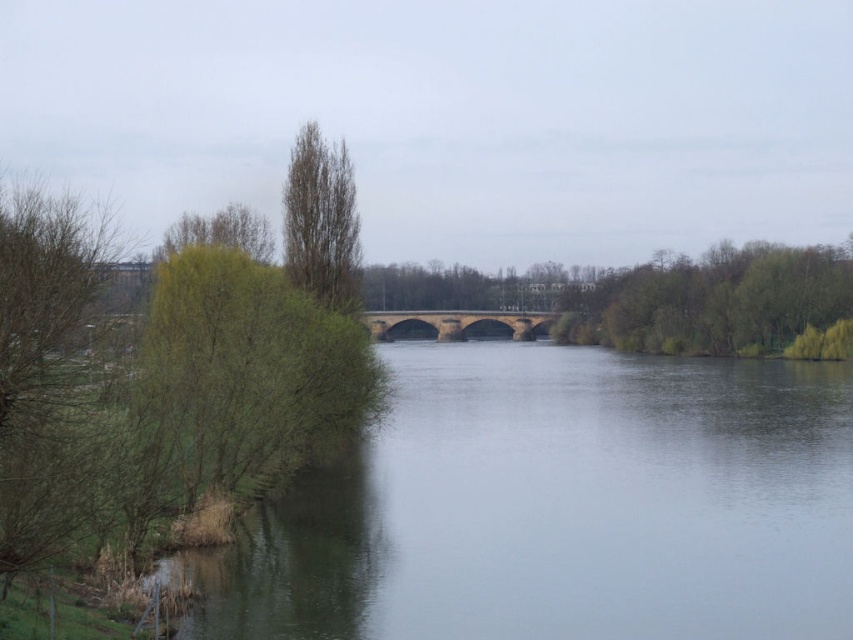
Who is positioned more to the left, clear water at center or green leafy tree at upper right?

clear water at center

Which is behind, point (490, 387) or point (682, 317)?

The point (682, 317) is more distant.

You are a GUI agent. You are given a task and a screenshot of the screen. Output one action in this format:
    pyautogui.click(x=<x>, y=<y>)
    Task: Click on the clear water at center
    The image size is (853, 640).
    Given the screenshot: What is the action you would take?
    [560, 508]

Does clear water at center appear over brown textured tree at upper center?

No, clear water at center is not above brown textured tree at upper center.

Is clear water at center smaller than brown textured tree at upper center?

No.

You are a GUI agent. You are given a task and a screenshot of the screen. Output one action in this format:
    pyautogui.click(x=<x>, y=<y>)
    Task: Click on the clear water at center
    The width and height of the screenshot is (853, 640).
    Given the screenshot: What is the action you would take?
    pyautogui.click(x=560, y=508)

Can you confirm if green leafy tree at upper right is positioned below brown textured tree at upper center?

No.

From the picture: Who is higher up, green leafy tree at upper right or brown textured tree at upper center?

green leafy tree at upper right

What do you see at coordinates (712, 300) in the screenshot? I see `green leafy tree at upper right` at bounding box center [712, 300].

You are a GUI agent. You are given a task and a screenshot of the screen. Output one action in this format:
    pyautogui.click(x=<x>, y=<y>)
    Task: Click on the green leafy tree at upper right
    The image size is (853, 640).
    Given the screenshot: What is the action you would take?
    pyautogui.click(x=712, y=300)